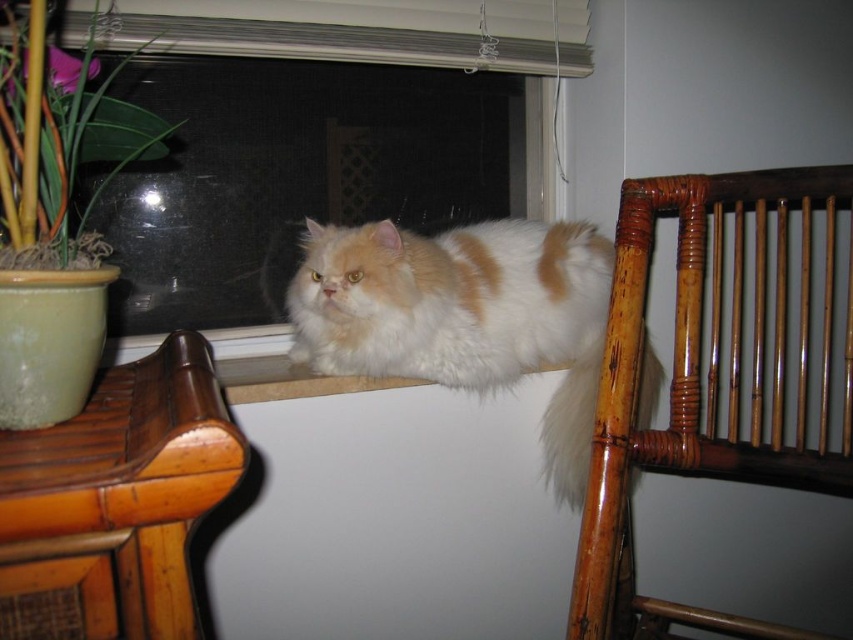
You are a small robot with a width of 60 centimeters. You need to move from the bamboo chair at right to the green leafy plant at left. Can you fit through the space between them without touching either?

The distance between the bamboo chair at right and the green leafy plant at left is 72.72 centimeters. Since your robot is 60 centimeters wide, there is enough space to move through without touching either object.

You are planning to place a 1.2 meter wide painting between the bamboo chair at left and the bamboo chair at right. Based on the scene, will the painting fit between them?

The bamboo chair at left is narrower than the bamboo chair at right. The total width between them is not provided, but since the left chair is narrower, there might be enough space. However, without exact measurements, it is uncertain if the 1.2 meter painting will fit.